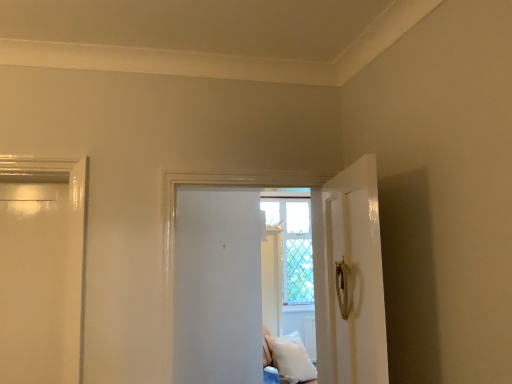
Question: Is white soft pillow at lower center not near white matte door at center?

Choices:
 (A) yes
 (B) no

Answer: (A)

Question: Is white soft pillow at lower center in front of white matte door at center?

Choices:
 (A) yes
 (B) no

Answer: (B)

Question: Could you tell me if white soft pillow at lower center is facing white matte door at center?

Choices:
 (A) yes
 (B) no

Answer: (B)

Question: Can you confirm if white soft pillow at lower center is taller than white matte door at center?

Choices:
 (A) no
 (B) yes

Answer: (A)

Question: Is white soft pillow at lower center positioned behind white matte door at center?

Choices:
 (A) yes
 (B) no

Answer: (A)

Question: Visually, is white matte door at center positioned to the left or to the right of clear glass window at center?

Choices:
 (A) left
 (B) right

Answer: (A)

Question: Is white matte door at center in front of or behind clear glass window at center in the image?

Choices:
 (A) behind
 (B) front

Answer: (B)

Question: Is point (252, 182) positioned closer to the camera than point (288, 208)?

Choices:
 (A) closer
 (B) farther

Answer: (A)

Question: From a real-world perspective, is white matte door at center above or below clear glass window at center?

Choices:
 (A) above
 (B) below

Answer: (B)

Question: Considering the relative positions of white soft pillow at lower center and white matte door at center in the image provided, is white soft pillow at lower center to the left or to the right of white matte door at center?

Choices:
 (A) left
 (B) right

Answer: (B)

Question: In the image, is white soft pillow at lower center positioned in front of or behind white matte door at center?

Choices:
 (A) behind
 (B) front

Answer: (A)

Question: Considering the positions of white soft pillow at lower center and white matte door at center in the image, is white soft pillow at lower center bigger or smaller than white matte door at center?

Choices:
 (A) small
 (B) big

Answer: (A)

Question: In terms of width, does white soft pillow at lower center look wider or thinner when compared to white matte door at center?

Choices:
 (A) thin
 (B) wide

Answer: (B)

Question: From the image's perspective, relative to white soft pillow at lower center, is white matte door at center above or below?

Choices:
 (A) below
 (B) above

Answer: (B)

Question: Considering the positions of white matte door at center and white soft pillow at lower center in the image, is white matte door at center bigger or smaller than white soft pillow at lower center?

Choices:
 (A) big
 (B) small

Answer: (A)